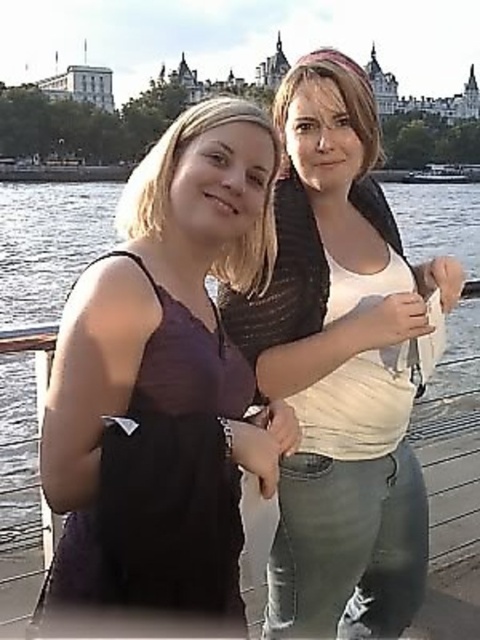
Does purple matte tank top at left come in front of white matte shirt at center?

Yes, it is in front of white matte shirt at center.

Which is in front, point (142, 225) or point (384, 397)?

Point (142, 225) is more forward.

Locate an element on the screen. purple matte tank top at left is located at coordinates (166, 378).